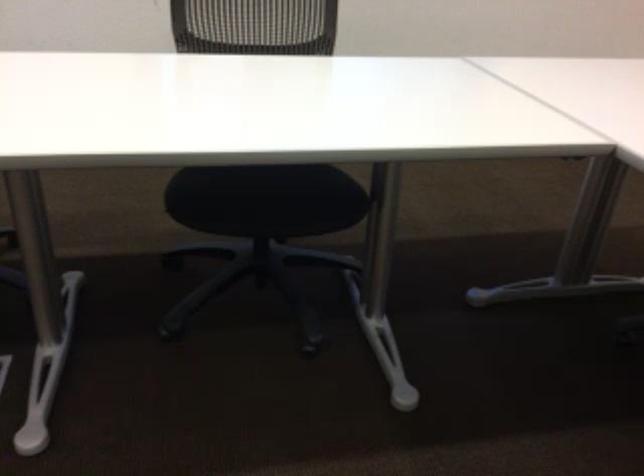
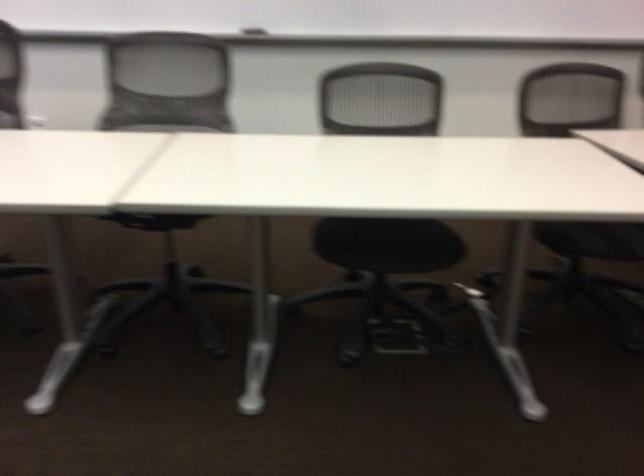
Based on the continuous images, in which direction is the camera rotating?

The camera rotated toward right-down.